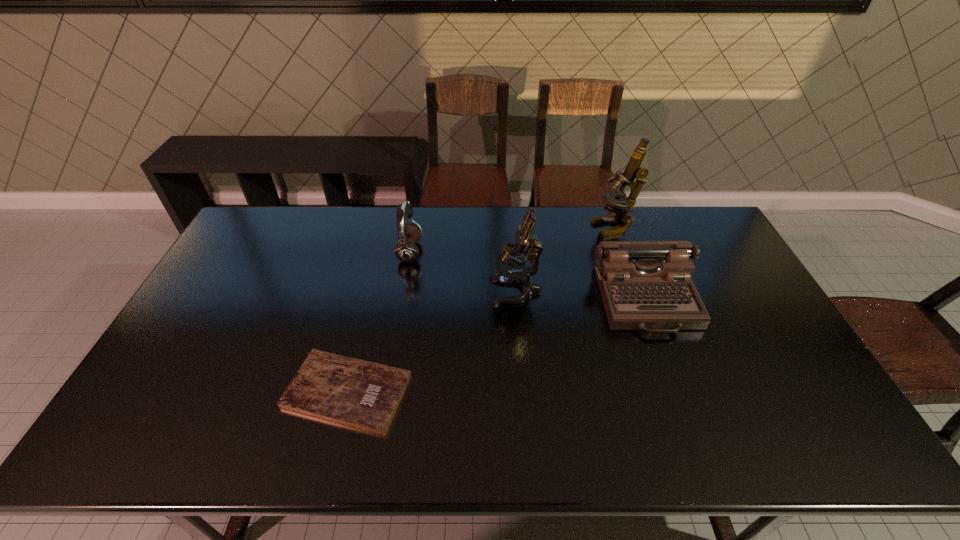
What are the coordinates of `free region at the right edge` in the screenshot? It's located at (732, 253).

You are a GUI agent. You are given a task and a screenshot of the screen. Output one action in this format:
    pyautogui.click(x=<x>, y=<y>)
    Task: Click on the free spot at the far left corner of the desktop
    This screenshot has height=540, width=960.
    Given the screenshot: What is the action you would take?
    pyautogui.click(x=282, y=207)

At what (x,y) coordinates should I click in order to perform the action: click on free space between the third shortest object and the shortest object. Please return your answer as a coordinate pair (x, y). The width and height of the screenshot is (960, 540). Looking at the image, I should click on (378, 322).

I want to click on free space between the shortest object and the second shortest object, so click(x=496, y=346).

Where is `unoccupied area between the earphone and the farther microscope`? This screenshot has width=960, height=540. unoccupied area between the earphone and the farther microscope is located at coordinates (512, 239).

I want to click on free space between the farther microscope and the earphone, so click(512, 239).

The width and height of the screenshot is (960, 540). What are the coordinates of `empty space between the farther microscope and the nearer microscope` in the screenshot? It's located at (565, 259).

Where is `empty location between the earphone and the third object from right to left`? This screenshot has height=540, width=960. empty location between the earphone and the third object from right to left is located at coordinates 463,272.

Locate an element on the screen. vacant area that lies between the fourth tallest object and the Bible is located at coordinates point(496,346).

In order to click on object identified as the third closest to the Bible in this screenshot , I will do `click(645, 285)`.